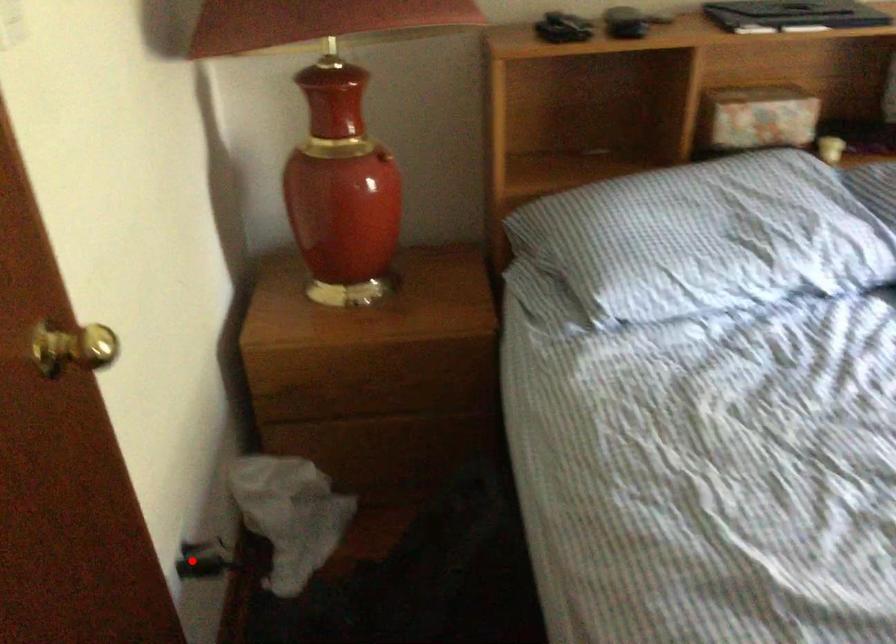
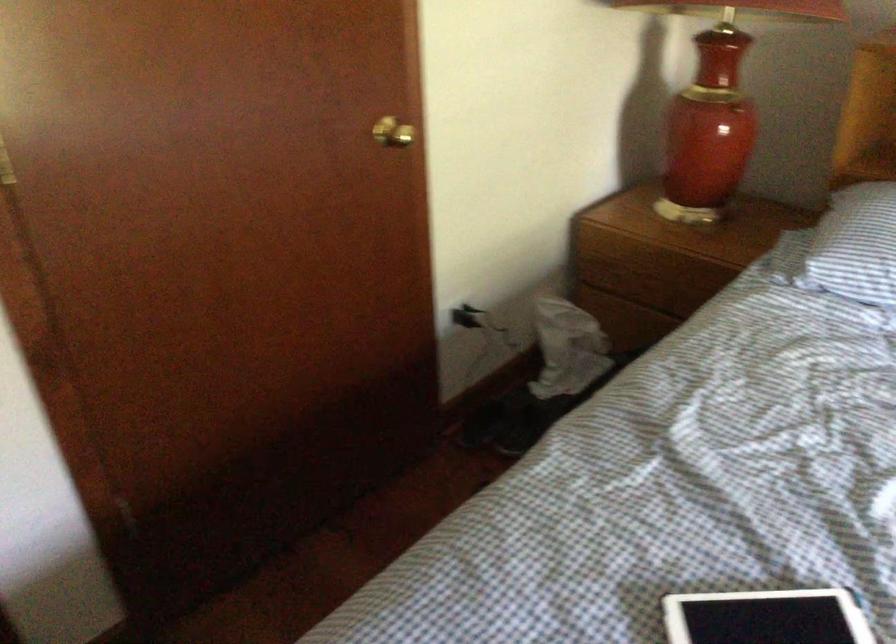
Question: I am providing you with two images of the same scene from different viewpoints. A red point is shown in image1. For the corresponding object point in image2, is it positioned nearer or farther from the camera?

Choices:
 (A) Nearer
 (B) Farther

Answer: (B)